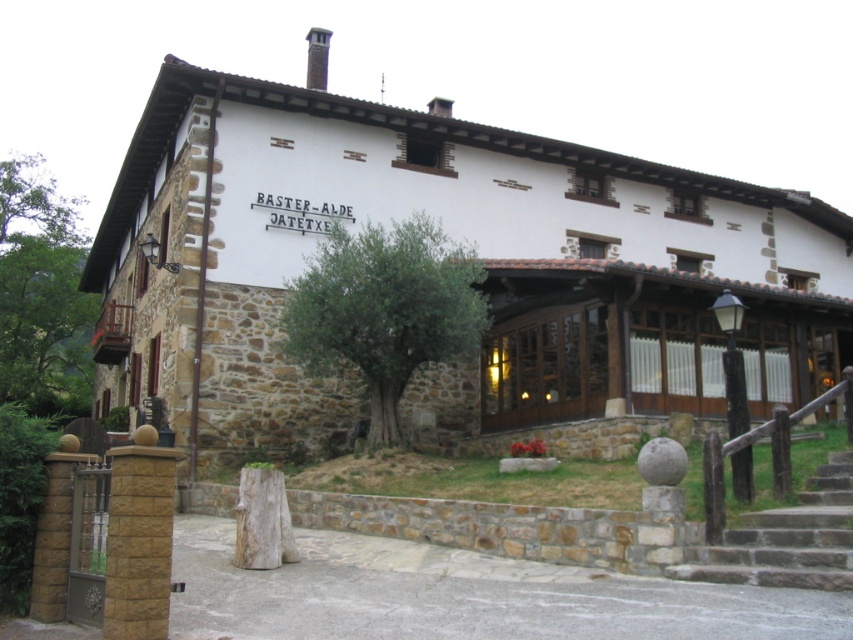
Question: Can you confirm if white stone building at center is thinner than green leafy tree at center?

Choices:
 (A) yes
 (B) no

Answer: (B)

Question: Observing the image, what is the correct spatial positioning of white stone building at center in reference to brown stone stairs at lower right?

Choices:
 (A) above
 (B) below

Answer: (A)

Question: Does green leafy tree at center appear on the left side of brown stone stairs at lower right?

Choices:
 (A) no
 (B) yes

Answer: (B)

Question: Which object is the farthest from the brown stone stairs at lower right?

Choices:
 (A) white stone building at center
 (B) green leafy tree at center

Answer: (A)

Question: Which of the following is the closest to the observer?

Choices:
 (A) (758, 544)
 (B) (489, 125)

Answer: (A)

Question: Which of the following is the farthest from the observer?

Choices:
 (A) (779, 579)
 (B) (370, 317)
 (C) (260, 442)

Answer: (C)